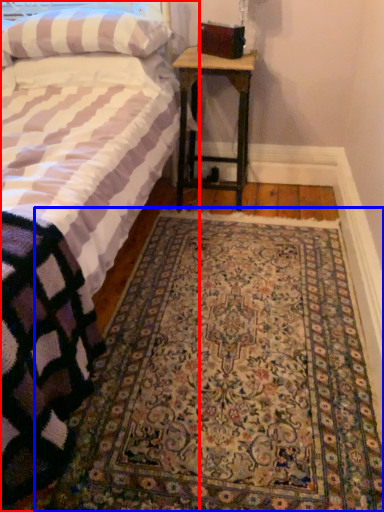
Question: Which of the following is the closest to the observer, bed (highlighted by a red box) or mat (highlighted by a blue box)?

Choices:
 (A) bed
 (B) mat

Answer: (A)